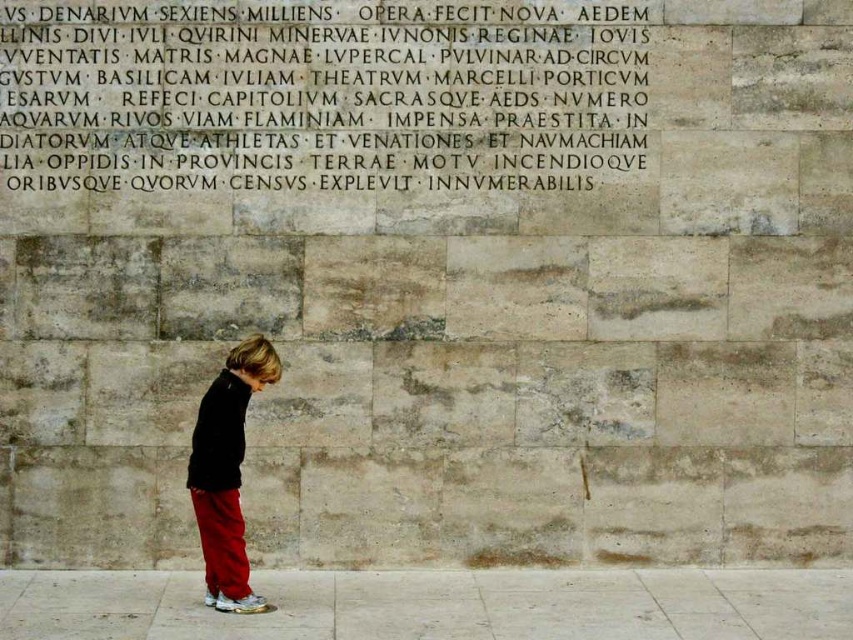
Between stone inscription at upper center and matte black jacket at center, which one is positioned higher?

stone inscription at upper center is higher up.

Can you confirm if stone inscription at upper center is taller than matte black jacket at center?

No.

In order to click on stone inscription at upper center in this screenshot , I will do `click(320, 96)`.